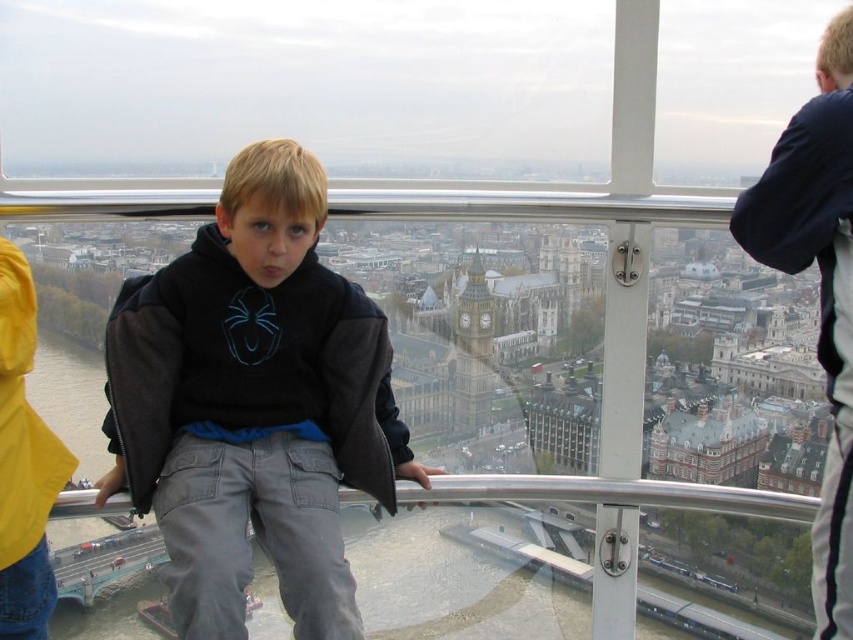
Question: Which object appears closest to the camera in this image?

Choices:
 (A) dark gray hoodie at center
 (B) matte gray clock tower at center

Answer: (A)

Question: Does dark gray hoodie at center appear over matte gray clock tower at center?

Choices:
 (A) no
 (B) yes

Answer: (B)

Question: Is dark gray hoodie at center smaller than matte gray clock tower at center?

Choices:
 (A) no
 (B) yes

Answer: (A)

Question: Can you confirm if dark gray hoodie at center is positioned below matte gray clock tower at center?

Choices:
 (A) yes
 (B) no

Answer: (B)

Question: Which point is farther to the camera?

Choices:
 (A) (369, 412)
 (B) (474, 392)

Answer: (B)